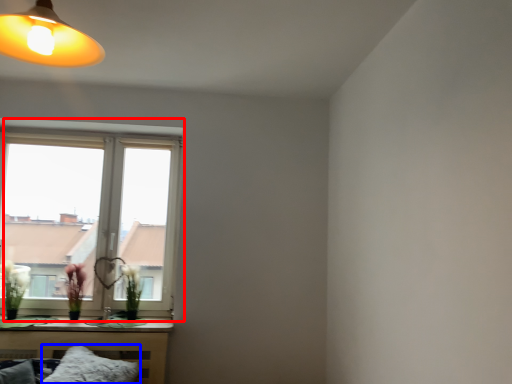
Question: Which object is closer to the camera taking this photo, window (highlighted by a red box) or pillow (highlighted by a blue box)?

Choices:
 (A) window
 (B) pillow

Answer: (B)